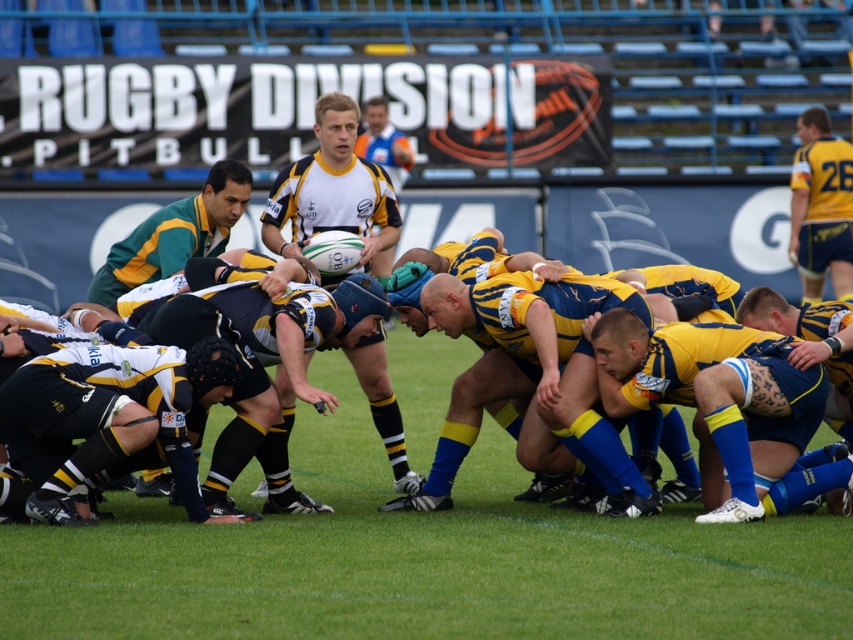
From the picture: Can you confirm if white matte rugby ball at center is taller than yellow jersey at right?

No, white matte rugby ball at center is not taller than yellow jersey at right.

Does white matte rugby ball at center appear over yellow jersey at right?

Incorrect, white matte rugby ball at center is not positioned above yellow jersey at right.

Between point (310, 221) and point (827, 209), which one is positioned in front?

Point (310, 221) is more forward.

Image resolution: width=853 pixels, height=640 pixels. In order to click on white matte rugby ball at center in this screenshot , I will do click(332, 188).

Is blue matte shorts at center thinner than yellow jersey at center?

No, blue matte shorts at center is not thinner than yellow jersey at center.

Is blue matte shorts at center behind yellow jersey at center?

No, blue matte shorts at center is closer to the viewer.

Which is behind, point (782, 440) or point (361, 148)?

Point (361, 148)

The width and height of the screenshot is (853, 640). What are the coordinates of `blue matte shorts at center` in the screenshot? It's located at tap(711, 394).

Based on the photo, is the position of green/yellow jersey at left more distant than that of yellow jersey at center?

Answer: No.

This screenshot has height=640, width=853. Describe the element at coordinates (175, 234) in the screenshot. I see `green/yellow jersey at left` at that location.

Find the location of a particular element. The height and width of the screenshot is (640, 853). green/yellow jersey at left is located at coordinates (175, 234).